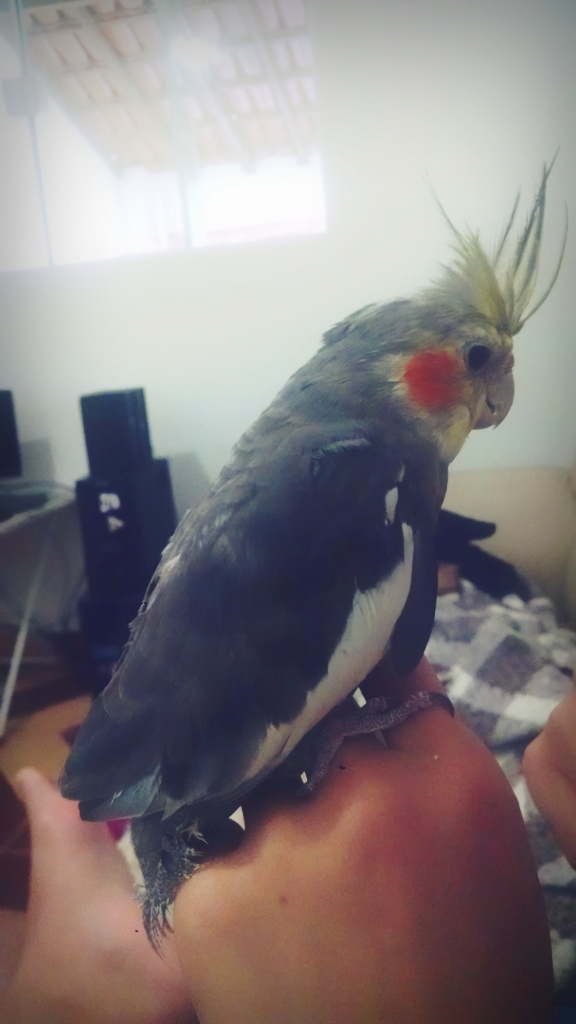
I want to click on white wall, so click(x=375, y=140).